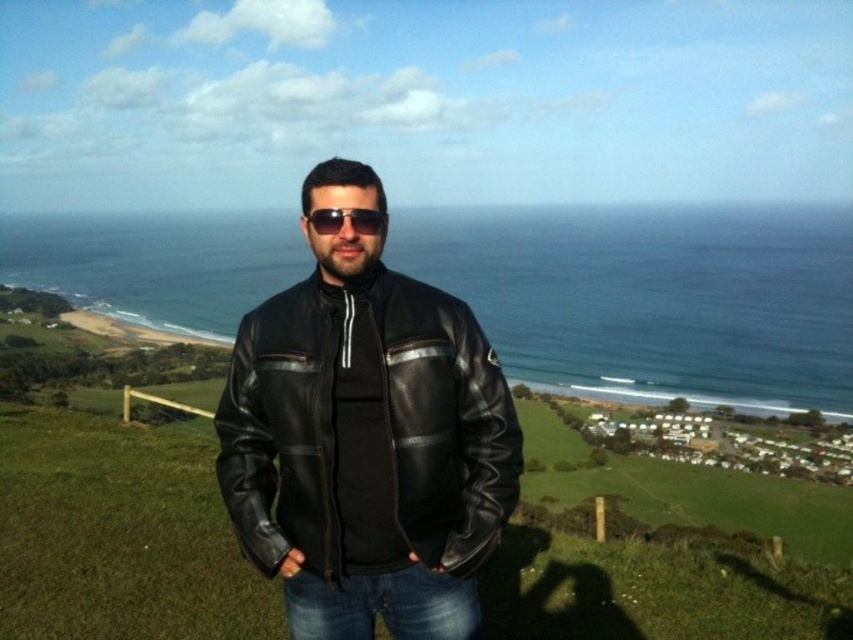
You are a fashion designer observing the person in the image. You need to determine if the distance between the black leather jacket at center and the sunglasses at center is sufficient to allow a 28 inch scarf to hang between them without touching either item. Can you confirm this?

The black leather jacket at center is 31.13 inches from sunglasses at center. Since the scarf is 28 inches long, it can hang between them without touching either item as there is enough space.

You are a photographer trying to capture the person in the image. You want to ensure that both the black leather jacket at center and the sunglasses at center are clearly visible in the frame. Based on their positions, which object should you focus on first to ensure both are in focus?

The black leather jacket at center is to the left of sunglasses at center. Since the jacket is further away from the camera, you should focus on the black leather jacket at center first to ensure both are in focus.